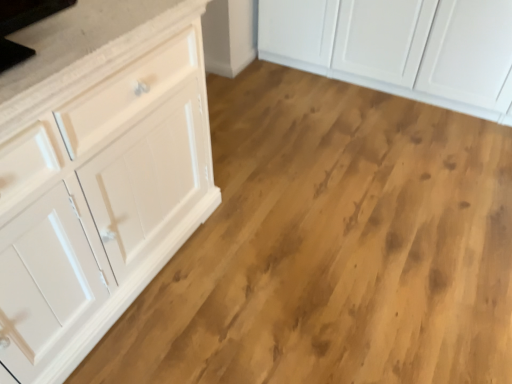
The width and height of the screenshot is (512, 384). Identify the location of vacant area on top of natural wood floor at center (from a real-world perspective). (339, 198).